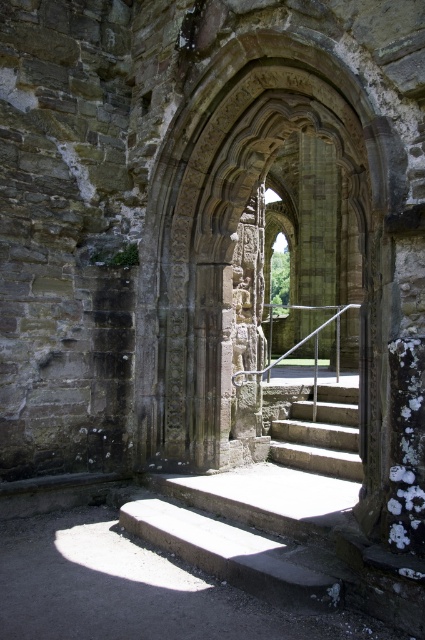
Does carved stone archway at center lie behind concrete steps at center?

Yes.

Does carved stone archway at center have a greater height compared to concrete steps at center?

Yes, carved stone archway at center is taller than concrete steps at center.

Is point (192, 140) behind point (326, 566)?

That is True.

What are the coordinates of `carved stone archway at center` in the screenshot? It's located at (238, 228).

Does concrete steps at center appear over smooth stone stairs at center?

Actually, concrete steps at center is below smooth stone stairs at center.

Is point (193, 492) positioned before point (285, 445)?

Yes.

Where is `concrete steps at center`? This screenshot has height=640, width=425. concrete steps at center is located at coordinates (266, 508).

Which of these two, carved stone archway at center or smooth stone stairs at center, stands taller?

Standing taller between the two is carved stone archway at center.

Measure the distance between point (170, 168) and camera.

26.47 feet

Identify the location of carved stone archway at center. (238, 228).